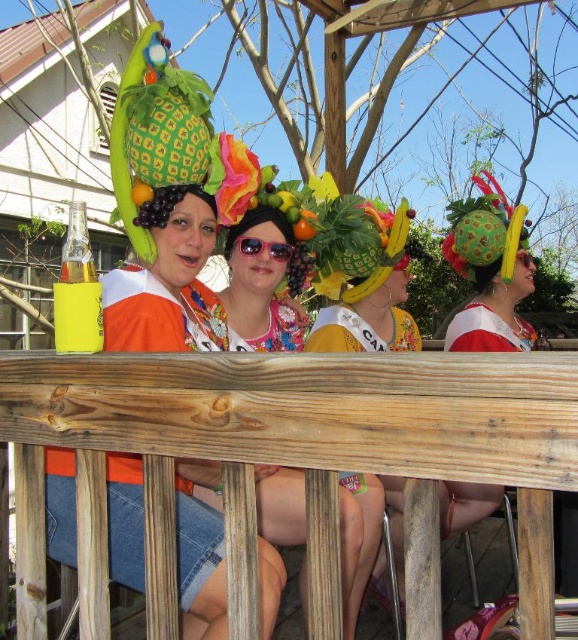
Question: Can you confirm if floral fabric dress at center is positioned above orange matte at center?

Choices:
 (A) yes
 (B) no

Answer: (B)

Question: Can you confirm if floral fabric dress at center is thinner than orange matte at upper center?

Choices:
 (A) yes
 (B) no

Answer: (B)

Question: Which object is positioned closest to the matte floral dress at center?

Choices:
 (A) orange matte at center
 (B) floral fabric dress at center
 (C) yellow matte cup at lower left

Answer: (A)

Question: Which is nearer to the matte floral dress at center?

Choices:
 (A) pink plastic sunglasses at center
 (B) floral fabric dress at center
 (C) yellow matte cup at lower left
 (D) orange matte at upper center

Answer: (A)

Question: Which of the following is the farthest from the observer?

Choices:
 (A) orange matte at upper center
 (B) matte floral dress at center

Answer: (B)

Question: Is yellow matte cup at lower left bigger than orange matte at upper center?

Choices:
 (A) yes
 (B) no

Answer: (A)